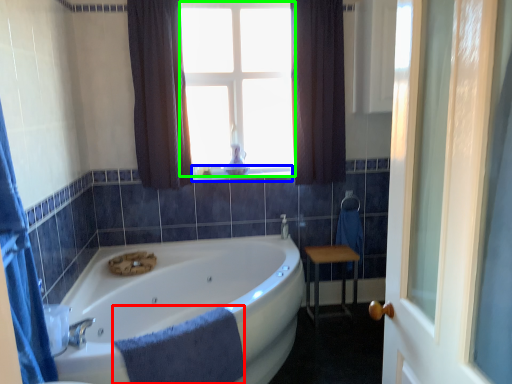
Question: Which object is positioned closest to bath towel (highlighted by a red box)? Select from window sill (highlighted by a blue box) and bay window (highlighted by a green box).

Choices:
 (A) window sill
 (B) bay window

Answer: (A)